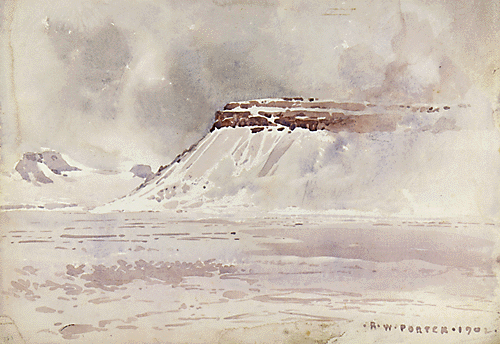
I want to click on front of painting, so click(x=401, y=224).